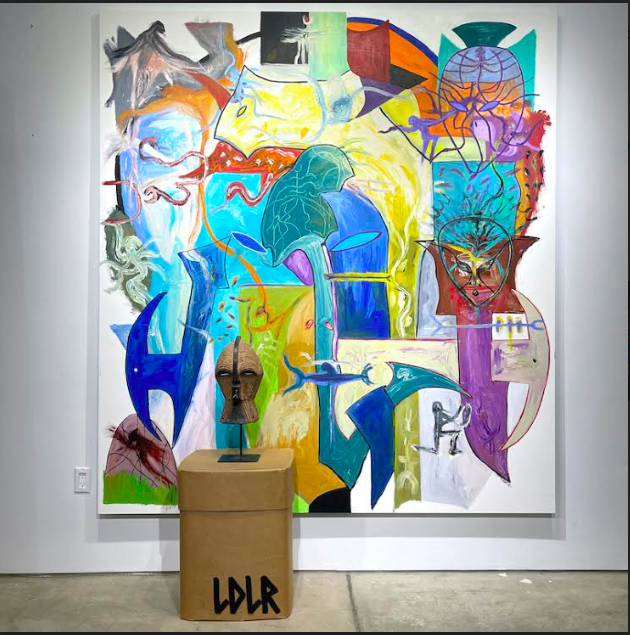
Image resolution: width=630 pixels, height=635 pixels. In order to click on box in this screenshot , I will do `click(210, 543)`.